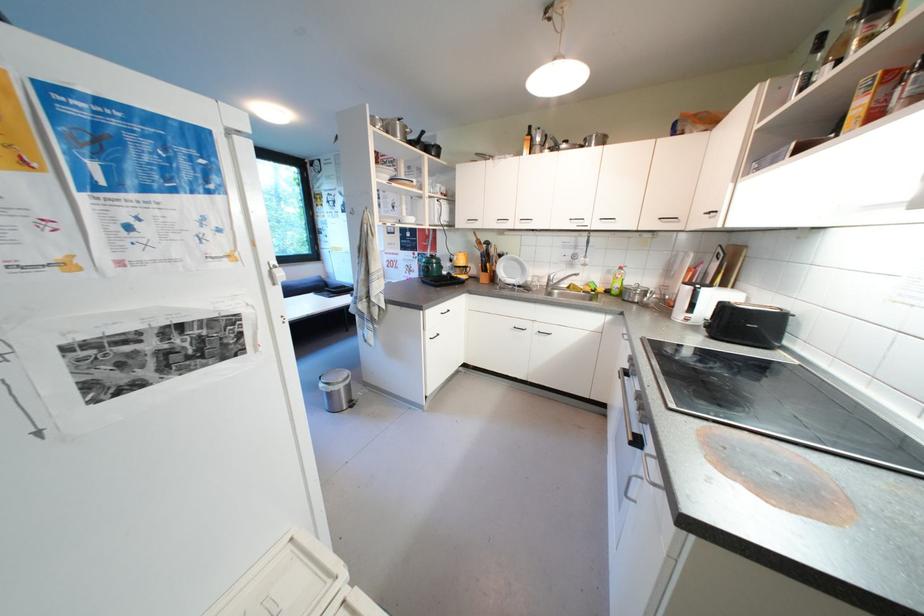
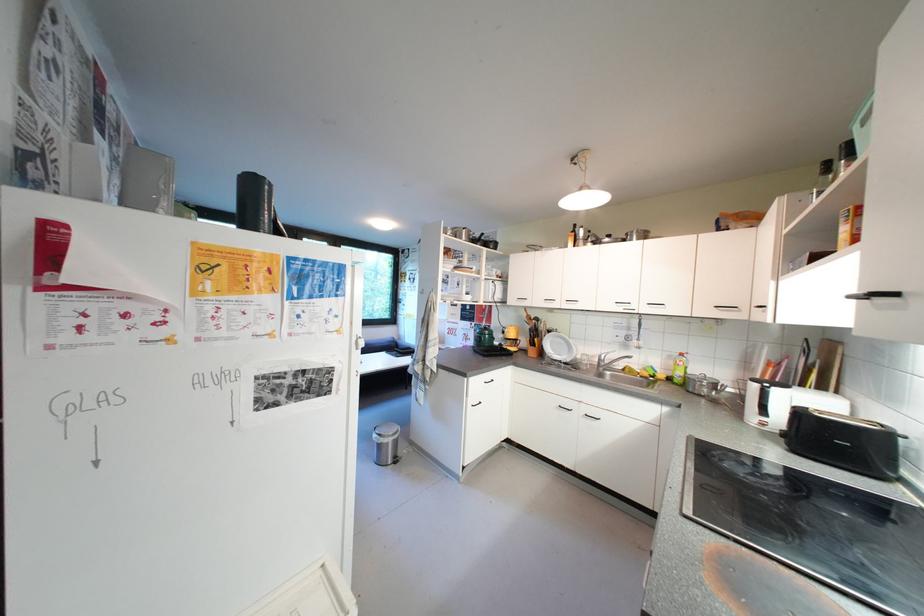
The point at [697,290] is marked in the first image. Where is the corresponding point in the second image?

(763, 387)